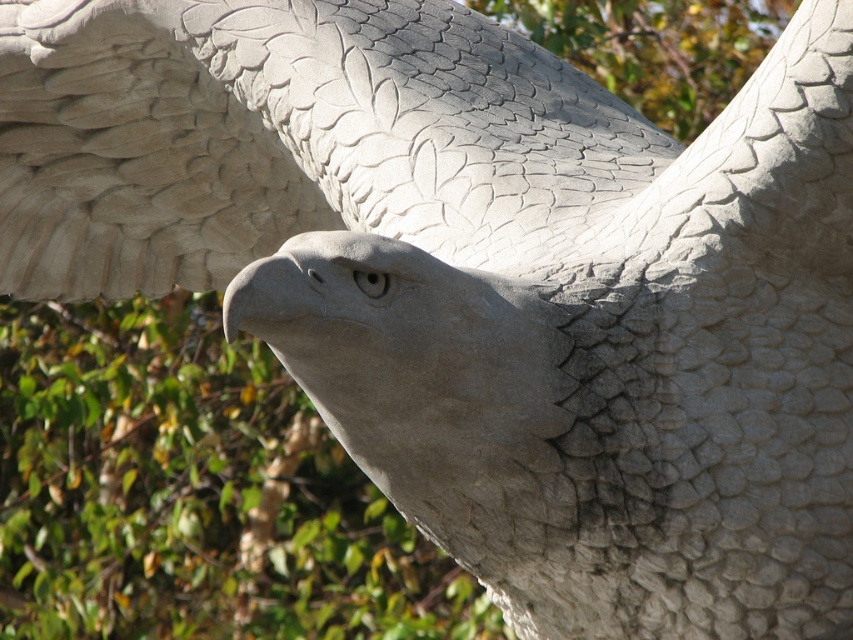
Question: Does gray stone wing at upper left have a smaller size compared to green leafy tree at center?

Choices:
 (A) yes
 (B) no

Answer: (A)

Question: Can you confirm if gray stone wing at upper left is thinner than green leafy tree at center?

Choices:
 (A) yes
 (B) no

Answer: (A)

Question: Which object is farther from the camera taking this photo?

Choices:
 (A) gray stone wing at upper left
 (B) green leafy tree at center

Answer: (B)

Question: Which object appears farthest from the camera in this image?

Choices:
 (A) gray stone wing at upper left
 (B) green leafy tree at center

Answer: (B)

Question: Is gray stone wing at upper left bigger than green leafy tree at center?

Choices:
 (A) yes
 (B) no

Answer: (B)